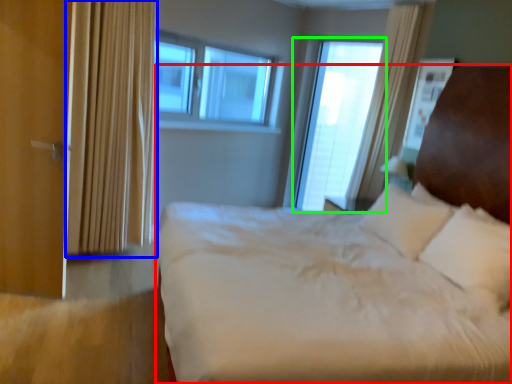
Question: Which is nearer to the bed (highlighted by a red box)? curtain (highlighted by a blue box) or window (highlighted by a green box).

Choices:
 (A) curtain
 (B) window

Answer: (A)